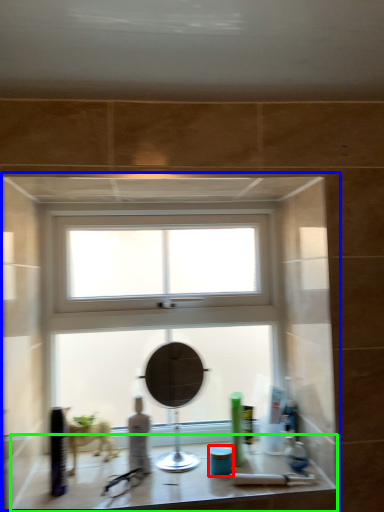
Question: Estimate the real-world distances between objects in this image. Which object is closer to toiletry (highlighted by a red box), window (highlighted by a blue box) or counter top (highlighted by a green box)?

Choices:
 (A) window
 (B) counter top

Answer: (B)